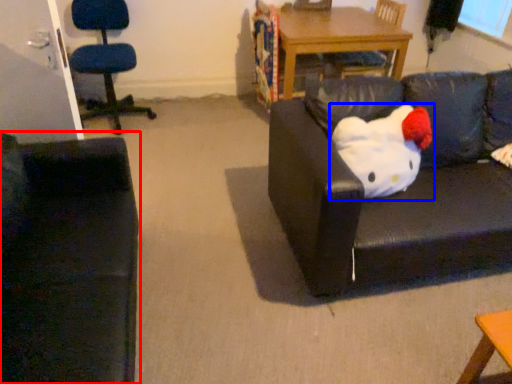
Question: Which of the following is the farthest to the observer, studio couch (highlighted by a red box) or toy (highlighted by a blue box)?

Choices:
 (A) studio couch
 (B) toy

Answer: (B)